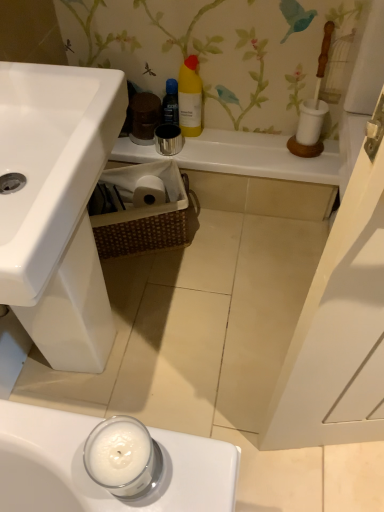
Question: Considering the relative sizes of white ceramic counter top at upper center and yellow plastic bottle at upper center in the image provided, is white ceramic counter top at upper center taller than yellow plastic bottle at upper center?

Choices:
 (A) no
 (B) yes

Answer: (A)

Question: Is white ceramic counter top at upper center further to camera compared to yellow plastic bottle at upper center?

Choices:
 (A) yes
 (B) no

Answer: (A)

Question: From a real-world perspective, is white ceramic counter top at upper center over yellow plastic bottle at upper center?

Choices:
 (A) no
 (B) yes

Answer: (A)

Question: Does white ceramic counter top at upper center turn towards yellow plastic bottle at upper center?

Choices:
 (A) no
 (B) yes

Answer: (A)

Question: Is white ceramic counter top at upper center closer to the viewer compared to yellow plastic bottle at upper center?

Choices:
 (A) yes
 (B) no

Answer: (B)

Question: Considering the positions of brown woven basket at lower center and black plastic spray can at upper center in the image, is brown woven basket at lower center bigger or smaller than black plastic spray can at upper center?

Choices:
 (A) small
 (B) big

Answer: (B)

Question: Is brown woven basket at lower center wider or thinner than black plastic spray can at upper center?

Choices:
 (A) thin
 (B) wide

Answer: (B)

Question: Is brown woven basket at lower center in front of or behind black plastic spray can at upper center in the image?

Choices:
 (A) behind
 (B) front

Answer: (B)

Question: Would you say brown woven basket at lower center is to the left or to the right of black plastic spray can at upper center in the picture?

Choices:
 (A) right
 (B) left

Answer: (B)

Question: Would you say white ceramic counter top at upper center is to the left or to the right of yellow plastic bottle at upper center in the picture?

Choices:
 (A) left
 (B) right

Answer: (B)

Question: From the image's perspective, is white ceramic counter top at upper center located above or below yellow plastic bottle at upper center?

Choices:
 (A) above
 (B) below

Answer: (B)

Question: From a real-world perspective, is white ceramic counter top at upper center physically located above or below yellow plastic bottle at upper center?

Choices:
 (A) above
 (B) below

Answer: (B)

Question: Does point (193, 151) appear closer or farther from the camera than point (195, 83)?

Choices:
 (A) farther
 (B) closer

Answer: (A)

Question: In terms of width, does yellow plastic bottle at upper center look wider or thinner when compared to white ceramic counter top at upper center?

Choices:
 (A) thin
 (B) wide

Answer: (A)

Question: Is yellow plastic bottle at upper center taller or shorter than white ceramic counter top at upper center?

Choices:
 (A) tall
 (B) short

Answer: (A)